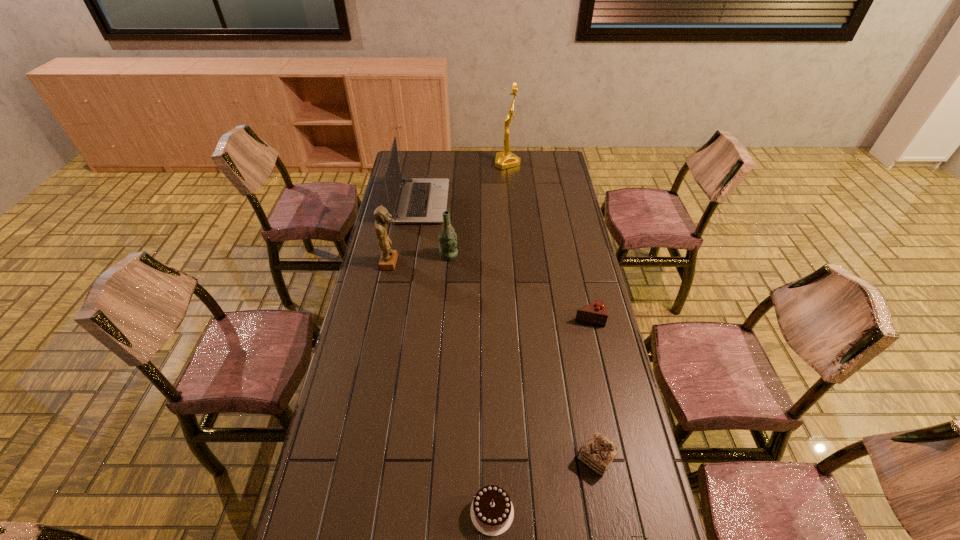
You are a GUI agent. You are given a task and a screenshot of the screen. Output one action in this format:
    pyautogui.click(x=<x>, y=<y>)
    Task: Click on the tallest object
    Image resolution: width=960 pixels, height=540 pixels.
    Given the screenshot: What is the action you would take?
    pyautogui.click(x=506, y=159)

This screenshot has height=540, width=960. I want to click on the farthest object, so click(x=506, y=159).

You are a GUI agent. You are given a task and a screenshot of the screen. Output one action in this format:
    pyautogui.click(x=<x>, y=<y>)
    Task: Click on the figurine
    Image resolution: width=960 pixels, height=540 pixels.
    Given the screenshot: What is the action you would take?
    pyautogui.click(x=388, y=259)

Locate an element on the screen. the second farthest object is located at coordinates (419, 200).

Image resolution: width=960 pixels, height=540 pixels. Identify the location of beer bottle. (447, 237).

Where is `the nearest chocolate cake`? This screenshot has width=960, height=540. the nearest chocolate cake is located at coordinates (492, 512).

Where is `the leftmost chocolate cake`? The width and height of the screenshot is (960, 540). the leftmost chocolate cake is located at coordinates (492, 512).

You are a GUI agent. You are given a task and a screenshot of the screen. Output one action in this format:
    pyautogui.click(x=<x>, y=<y>)
    Task: Click on the fifth farthest object
    
    Given the screenshot: What is the action you would take?
    pyautogui.click(x=596, y=313)

The width and height of the screenshot is (960, 540). Find the location of `the third nearest object`. the third nearest object is located at coordinates (598, 453).

Identify the location of vacant space located on the front-facing side of the farthest object. The width and height of the screenshot is (960, 540). (454, 163).